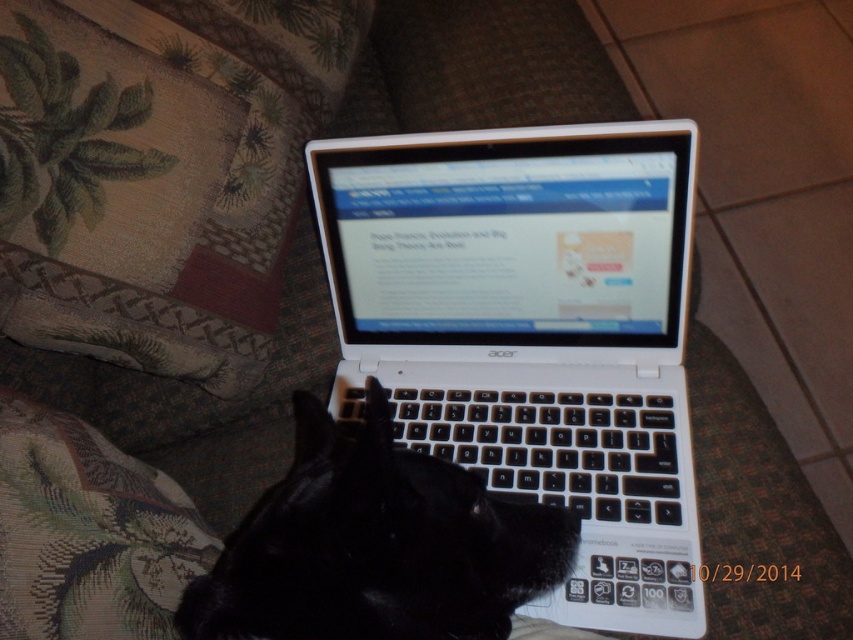
Is white plastic laptop at center bigger than black fur cat at center?

Indeed, white plastic laptop at center has a larger size compared to black fur cat at center.

Identify the location of white plastic laptop at center. The image size is (853, 640). (532, 333).